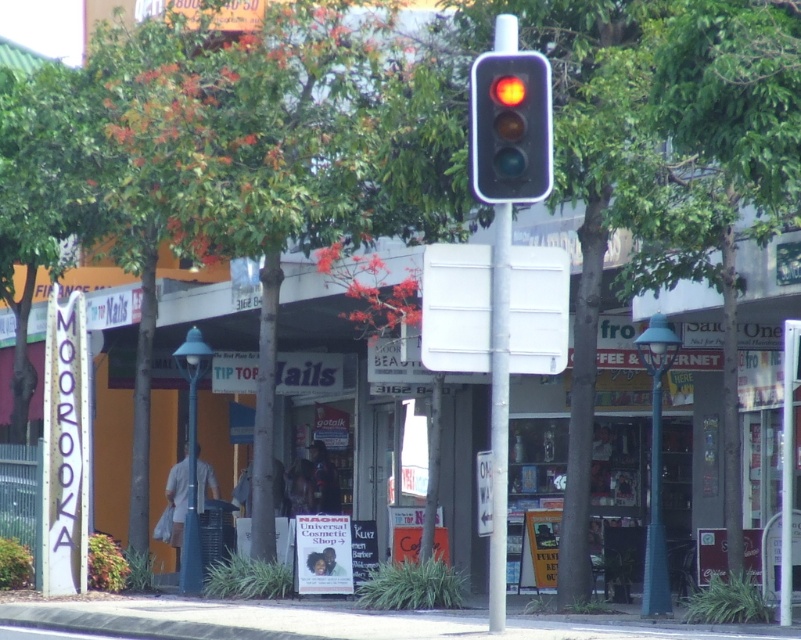
The width and height of the screenshot is (801, 640). What do you see at coordinates (510, 128) in the screenshot?
I see `matte glass traffic light at center` at bounding box center [510, 128].

Which is in front, point (475, 106) or point (490, 346)?

Point (475, 106)

Describe the element at coordinates (510, 128) in the screenshot. I see `matte glass traffic light at center` at that location.

The image size is (801, 640). Find the location of `matte glass traffic light at center`. matte glass traffic light at center is located at coordinates (510, 128).